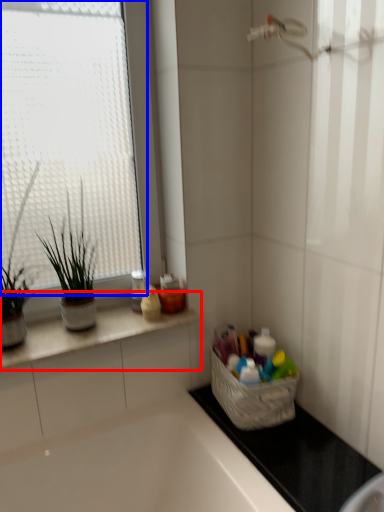
Question: Which point is closer to the camera, countertop (highlighted by a red box) or window (highlighted by a blue box)?

Choices:
 (A) countertop
 (B) window

Answer: (B)